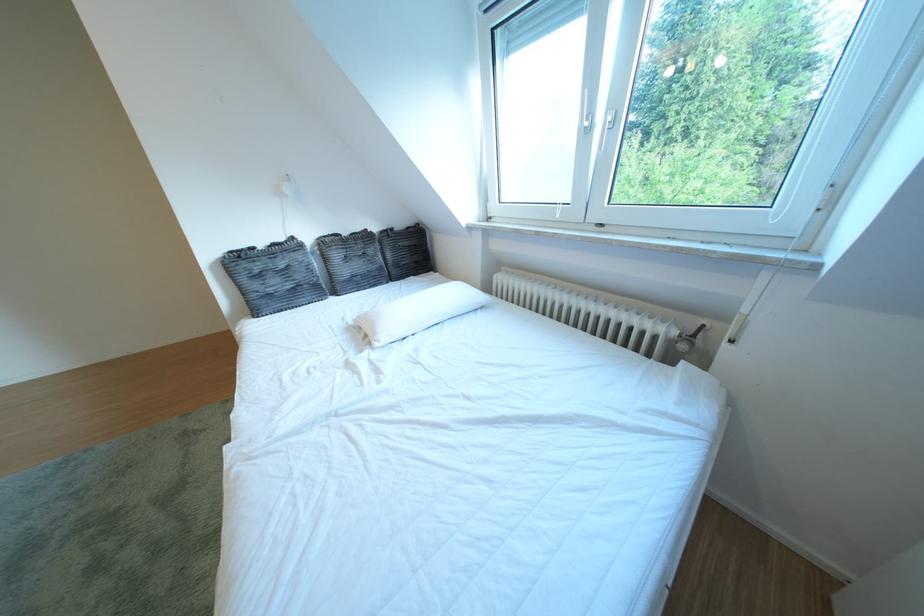
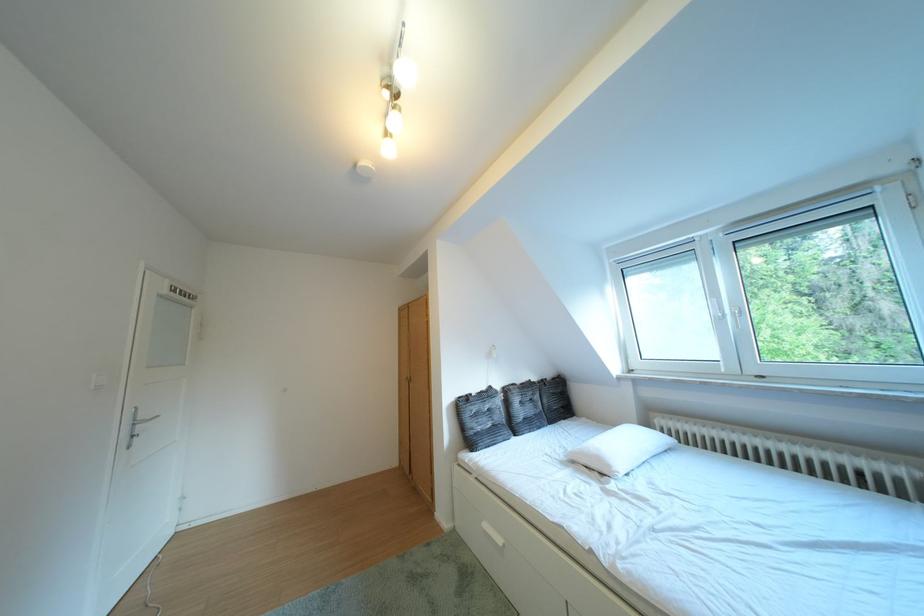
In the second image, find the point that corresponds to point (603, 119) in the first image.

(736, 315)